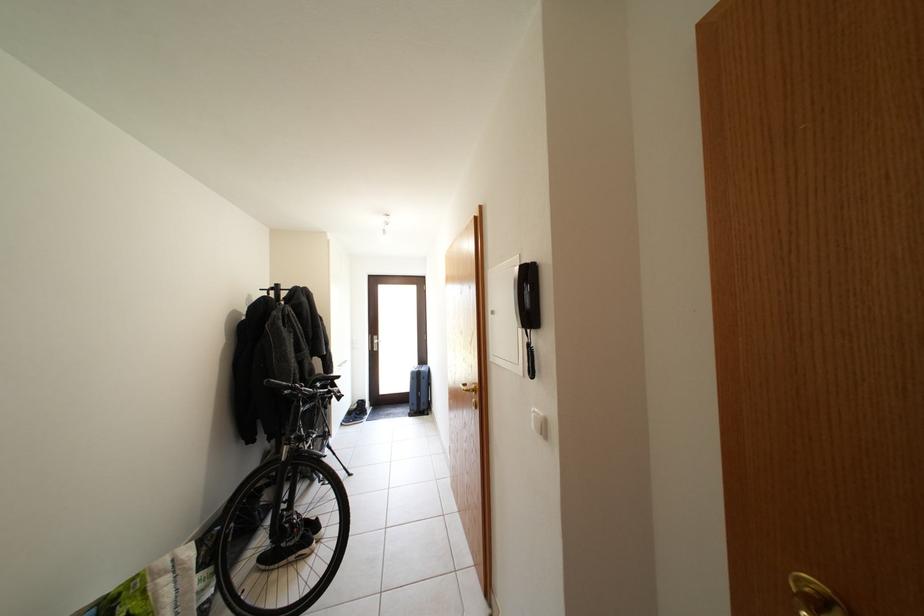
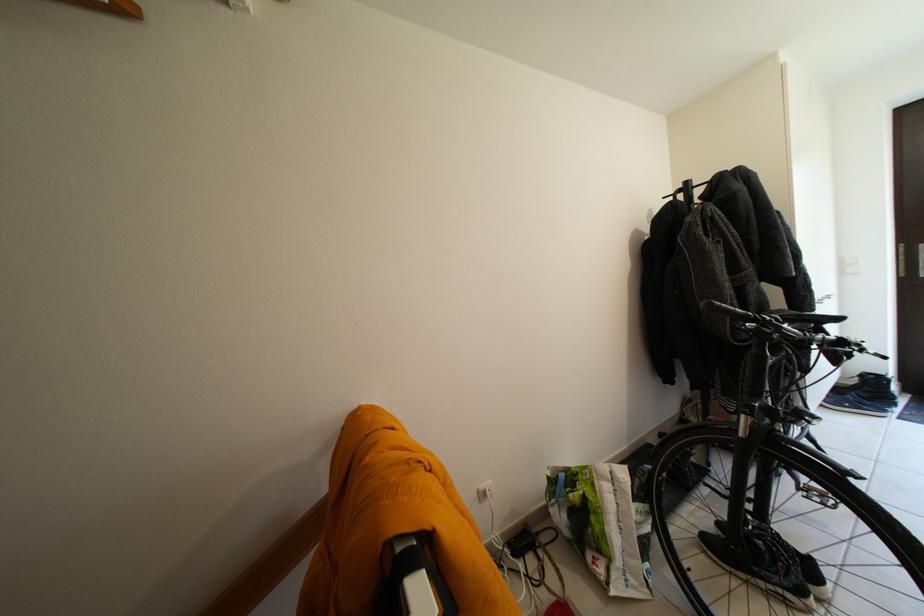
Where in the second image is the point corresponding to pixel 359 418 from the first image?

(845, 395)